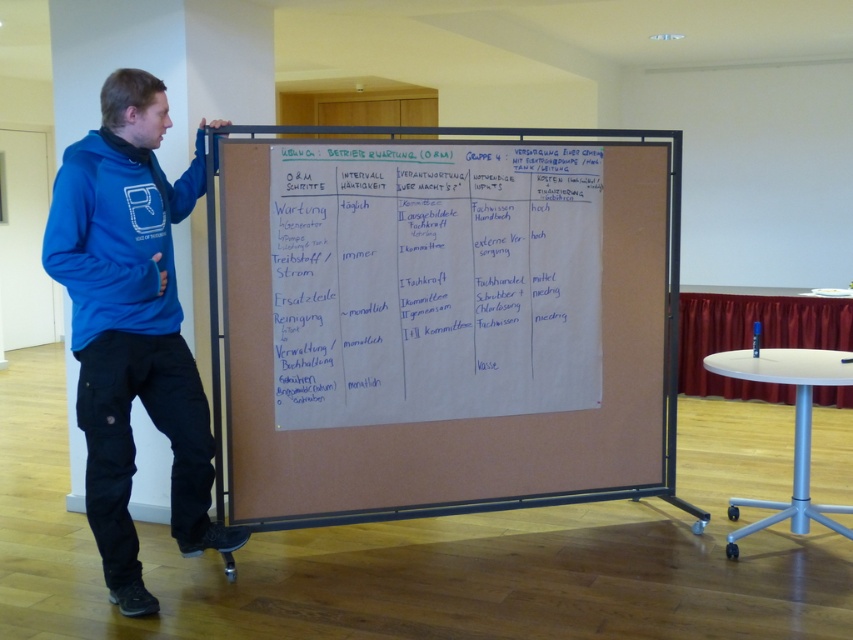
Question: Which point is closer to the camera?

Choices:
 (A) [413, 419]
 (B) [115, 256]
 (C) [91, 240]

Answer: (C)

Question: Which of these objects is positioned closest to the corkboard at center?

Choices:
 (A) blue cotton hoodie at left
 (B) blue fleece sweatshirt at left

Answer: (A)

Question: Estimate the real-world distances between objects in this image. Which object is farther from the blue fleece sweatshirt at left?

Choices:
 (A) corkboard at center
 (B) blue cotton hoodie at left

Answer: (A)

Question: From the image, what is the correct spatial relationship of corkboard at center in relation to blue cotton hoodie at left?

Choices:
 (A) left
 (B) right

Answer: (B)

Question: From the image, what is the correct spatial relationship of corkboard at center in relation to blue fleece sweatshirt at left?

Choices:
 (A) left
 (B) right

Answer: (B)

Question: Is corkboard at center to the left of blue cotton hoodie at left from the viewer's perspective?

Choices:
 (A) no
 (B) yes

Answer: (A)